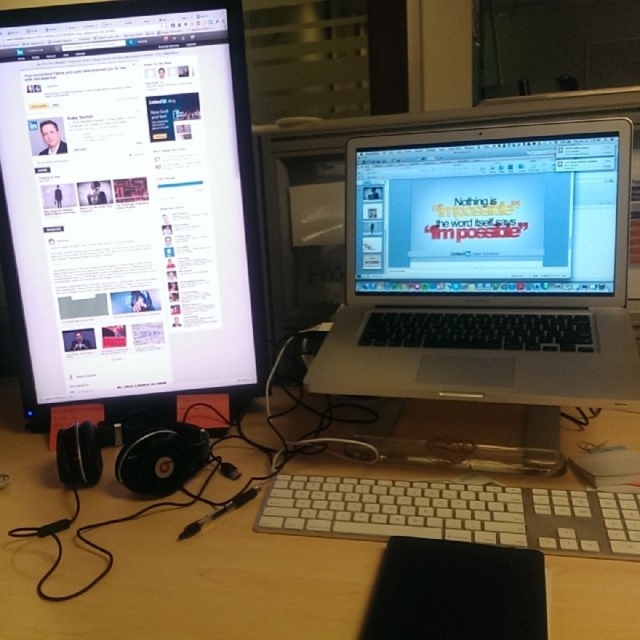
From the picture: You are organizing a presentation and need to place a large poster on the desk. Considering the spatial relationship between the matte black monitor at left and the wooden desk at center, will the poster fit on the desk without overlapping the monitor?

The matte black monitor at left is much taller than the wooden desk at center. Since the monitor is taller, it would occupy more vertical space on the desk, potentially limiting the area available for placing the poster. Therefore, the poster might not fit without overlapping the monitor.

You are standing 5 feet away from the desk. Can you reach the point at coordinates point (20,256) without moving your feet? Explain your reasoning.

The point at coordinates point (20,256) is 3.59 feet away from the viewer. Since you are standing 5 feet away from the desk, you cannot reach it without moving your feet because the distance between you and the point is greater than your reach.

You are setting up a video call and need to place both the matte black monitor at left and the silver metallic laptop at center on a desk. Given their sizes, which device should you place first to ensure there is enough space for both?

The matte black monitor at left is much taller than the silver metallic laptop at center, so you should place the taller matte black monitor at left first to ensure there is enough space for both devices on the desk.